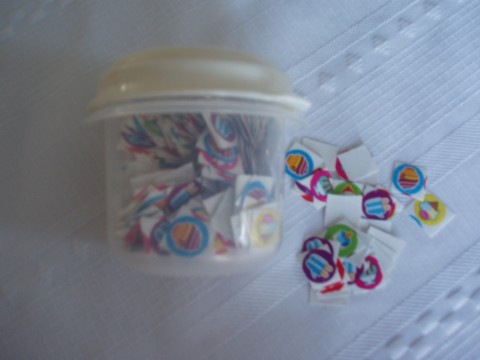
The width and height of the screenshot is (480, 360). What are the coordinates of `sticker paper` in the screenshot? It's located at (340, 209).